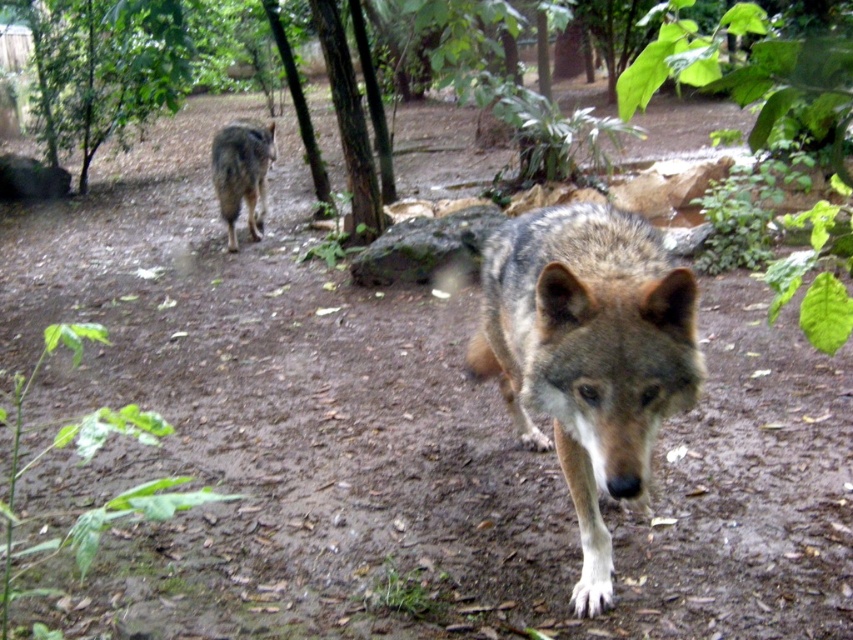
You are a wildlife photographer trying to capture the gray fur wolf at center and the gray fur wolf at upper left in your photo. Which wolf will appear larger in your camera viewfinder?

The gray fur wolf at center will appear larger in the camera viewfinder because it is closer to the viewer than the gray fur wolf at upper left.

You are a photographer trying to capture both the green leafy tree at upper left and the gray fur wolf at upper left in a single frame. Based on their positions, which object is wider in the image?

The green leafy tree at upper left might be wider than gray fur wolf at upper left according to the description.

From the picture: You are standing in a forest and see two points marked in the scene. The first point is at coordinates point (503, 266) and the second is at point (125, 81). Which point is closer to you?

Point (503, 266) is closer to the viewer than point (125, 81).